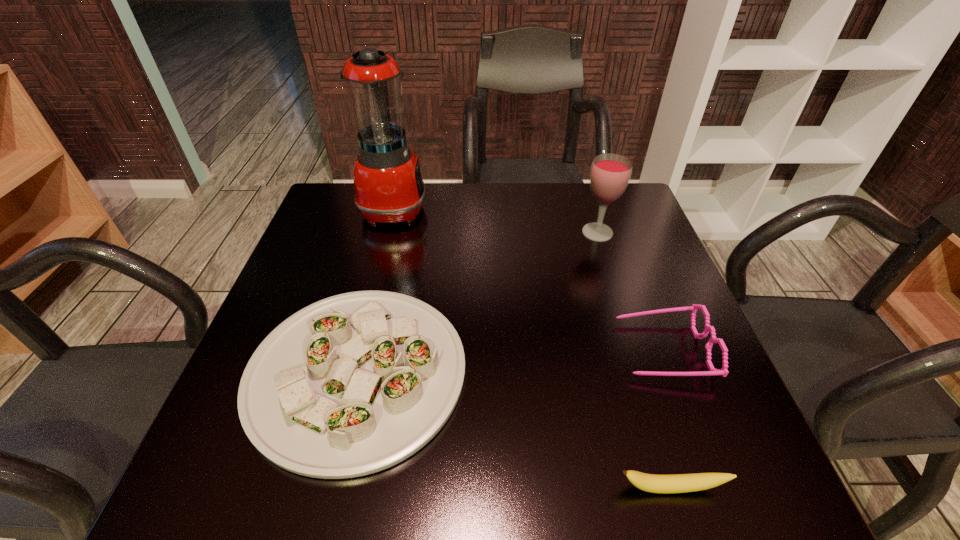
Locate an element on the screen. This screenshot has height=540, width=960. vacant region located 0.210m on the right of the platter is located at coordinates (576, 373).

You are a GUI agent. You are given a task and a screenshot of the screen. Output one action in this format:
    pyautogui.click(x=<x>, y=<y>)
    Task: Click on the food processor positioned at the far edge
    The image size is (960, 540).
    Given the screenshot: What is the action you would take?
    (x=388, y=184)

The width and height of the screenshot is (960, 540). I want to click on wineglass that is at the far edge, so click(x=610, y=174).

Where is `platter that is at the near edge`? platter that is at the near edge is located at coordinates (353, 384).

The width and height of the screenshot is (960, 540). What are the coordinates of `banana at the near edge` in the screenshot? It's located at (680, 483).

The height and width of the screenshot is (540, 960). I want to click on food processor that is at the left edge, so click(x=388, y=184).

At what (x,y) coordinates should I click in order to perform the action: click on platter at the left edge. Please return your answer as a coordinate pair (x, y). Image resolution: width=960 pixels, height=540 pixels. Looking at the image, I should click on (353, 384).

The height and width of the screenshot is (540, 960). I want to click on wineglass at the right edge, so click(610, 174).

Where is `spectacles situated at the right edge`? This screenshot has height=540, width=960. spectacles situated at the right edge is located at coordinates (724, 372).

You are a GUI agent. You are given a task and a screenshot of the screen. Output one action in this format:
    pyautogui.click(x=<x>, y=<y>)
    Task: Click on the banana located at the right edge
    This screenshot has height=540, width=960.
    Given the screenshot: What is the action you would take?
    pyautogui.click(x=680, y=483)